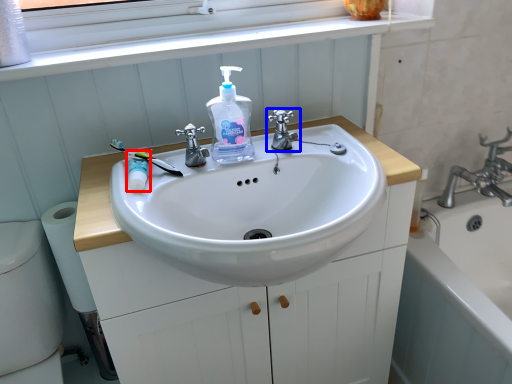
Question: Which object appears closest to the camera in this image, mouthwash (highlighted by a red box) or tap (highlighted by a blue box)?

Choices:
 (A) mouthwash
 (B) tap

Answer: (A)